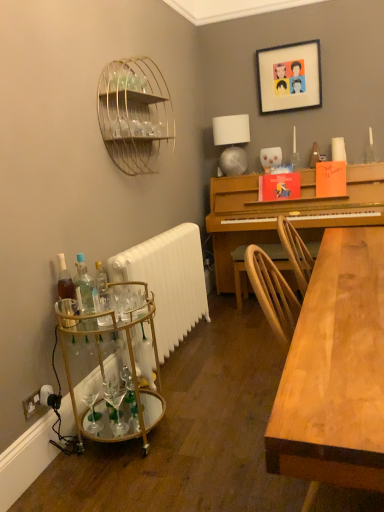
I want to click on clear glass bottle at left, which is counted as the 1th bottle, starting from the right, so [102, 289].

Image resolution: width=384 pixels, height=512 pixels. Describe the element at coordinates (102, 289) in the screenshot. I see `clear glass bottle at left, which ranks as the 3th bottle in left-to-right order` at that location.

Measure the distance between point (76, 263) and camera.

The depth of point (76, 263) is 6.58 feet.

This screenshot has height=512, width=384. What are the coordinates of `satin silver lampshade at upper right` in the screenshot? It's located at (232, 142).

Identify the location of translucent glass bottle at lower left, the 3th bottle when ordered from right to left. The height and width of the screenshot is (512, 384). (66, 290).

Looking at this image, measure the distance between point [303,106] and camera.

The distance of point [303,106] from camera is 11.98 feet.

At what (x,y) coordinates should I click in order to perform the action: click on gold wire shelf at upper left. Please return your answer as a coordinate pair (x, y). Looking at the image, I should click on (134, 113).

In order to click on table on the right side of clear glass bottle at left, which ranks as the 3th bottle in left-to-right order in this screenshot , I will do `click(112, 371)`.

Between clear glass bottle at left, which is counted as the 1th bottle, starting from the right, and gold glass bar cart at left, which one appears on the right side from the viewer's perspective?

Positioned to the right is gold glass bar cart at left.

Considering their positions, is clear glass bottle at left, which ranks as the 3th bottle in left-to-right order, located in front of or behind gold glass bar cart at left?

In the image, clear glass bottle at left, which ranks as the 3th bottle in left-to-right order, appears behind gold glass bar cart at left.

Does white matte radiator at lower left have a lesser height compared to translucent glass bottles at lower left, placed as the second bottle when sorted from left to right?

Incorrect, the height of white matte radiator at lower left does not fall short of that of translucent glass bottles at lower left, placed as the second bottle when sorted from left to right.

Is translucent glass bottles at lower left, arranged as the second bottle when viewed from the right, completely or partially inside white matte radiator at lower left?

No, translucent glass bottles at lower left, arranged as the second bottle when viewed from the right, is not inside white matte radiator at lower left.

From a real-world perspective, between white matte radiator at lower left and translucent glass bottles at lower left, arranged as the second bottle when viewed from the right, who is vertically lower?

In real-world perspective, white matte radiator at lower left is lower.

Can you confirm if white matte radiator at lower left is positioned to the left of translucent glass bottles at lower left, placed as the second bottle when sorted from left to right?

No.

Which object is positioned more to the right, gold glass bar cart at left or gold wire shelf at upper left?

→ gold wire shelf at upper left is more to the right.

Does gold glass bar cart at left lie in front of gold wire shelf at upper left?

Yes, it is.

Are gold glass bar cart at left and gold wire shelf at upper left located far from each other?

Yes, gold glass bar cart at left and gold wire shelf at upper left are located far from each other.

From a real-world perspective, who is located higher, wooden picture frame at upper center or gold wire shelf at upper left?

From a 3D spatial view, wooden picture frame at upper center is above.

In terms of height, does wooden picture frame at upper center look taller or shorter compared to gold wire shelf at upper left?

wooden picture frame at upper center is shorter than gold wire shelf at upper left.

From the picture: From the image's perspective, does wooden picture frame at upper center appear higher than gold wire shelf at upper left?

Yes.

Locate an element on the screen. The width and height of the screenshot is (384, 512). picture frame lying on the right of gold wire shelf at upper left is located at coordinates (289, 77).

Can you see clear glass bottle at left, which ranks as the 3th bottle in left-to-right order, touching satin silver lampshade at upper right?

No, clear glass bottle at left, which ranks as the 3th bottle in left-to-right order, is not in contact with satin silver lampshade at upper right.

Considering the relative sizes of clear glass bottle at left, which ranks as the 3th bottle in left-to-right order, and satin silver lampshade at upper right in the image provided, is clear glass bottle at left, which ranks as the 3th bottle in left-to-right order, thinner than satin silver lampshade at upper right?

Indeed, clear glass bottle at left, which ranks as the 3th bottle in left-to-right order, has a lesser width compared to satin silver lampshade at upper right.

From a real-world perspective, relative to satin silver lampshade at upper right, is clear glass bottle at left, which is counted as the 1th bottle, starting from the right, vertically above or below?

From a real-world perspective, clear glass bottle at left, which is counted as the 1th bottle, starting from the right, is physically below satin silver lampshade at upper right.

Is satin silver lampshade at upper right at the back of clear glass bottle at left, which is counted as the 1th bottle, starting from the right?

No, clear glass bottle at left, which is counted as the 1th bottle, starting from the right,'s orientation is not away from satin silver lampshade at upper right.

From the image's perspective, is white matte radiator at lower left beneath gold glass bar cart at left?

Incorrect, from the image's perspective, white matte radiator at lower left is higher than gold glass bar cart at left.

In the scene shown: Who is more distant, white matte radiator at lower left or gold glass bar cart at left?

white matte radiator at lower left.

Would you consider white matte radiator at lower left to be distant from gold glass bar cart at left?

That's not correct — white matte radiator at lower left is a little close to gold glass bar cart at left.

In the image, there is a gold glass bar cart at left. Identify the location of radiator above it (from the image's perspective). Image resolution: width=384 pixels, height=512 pixels. (168, 281).

At what (x,y) coordinates should I click in order to perform the action: click on bottle that is the 1st one when counting leftward from the satin silver lampshade at upper right. Please return your answer as a coordinate pair (x, y). The width and height of the screenshot is (384, 512). Looking at the image, I should click on (102, 289).

How many degrees apart are the facing directions of satin silver lampshade at upper right and clear glass bottle at left, which is counted as the 1th bottle, starting from the right?

The facing directions of satin silver lampshade at upper right and clear glass bottle at left, which is counted as the 1th bottle, starting from the right, are 76.3 degrees apart.

Which of these two, satin silver lampshade at upper right or clear glass bottle at left, which ranks as the 3th bottle in left-to-right order, stands shorter?

With less height is clear glass bottle at left, which ranks as the 3th bottle in left-to-right order.

Is point (232, 139) in front of point (104, 286)?

No, it is not.

Where is `bottle that is the 2nd object located above the gold glass bar cart at left (from the image's perspective)`? The height and width of the screenshot is (512, 384). bottle that is the 2nd object located above the gold glass bar cart at left (from the image's perspective) is located at coordinates (102, 289).

You are a GUI agent. You are given a task and a screenshot of the screen. Output one action in this format:
    pyautogui.click(x=<x>, y=<y>)
    Task: Click on the bottle that is the 3rd object above the white matte radiator at lower left (from a real-world perspective)
    Image resolution: width=384 pixels, height=512 pixels.
    Given the screenshot: What is the action you would take?
    pyautogui.click(x=84, y=284)

Estimate the real-world distances between objects in this image. Which object is further from light wood table at right, wooden picture frame at upper center or gold wire shelf at upper left?

wooden picture frame at upper center is further to light wood table at right.

When comparing their distances from translucent glass bottles at lower left, placed as the second bottle when sorted from left to right, does satin silver lampshade at upper right or white matte radiator at lower left seem closer?

Based on the image, white matte radiator at lower left appears to be nearer to translucent glass bottles at lower left, placed as the second bottle when sorted from left to right.

Which object lies further to the anchor point white matte radiator at lower left, satin silver lampshade at upper right or gold wire shelf at upper left?

satin silver lampshade at upper right is positioned further to the anchor white matte radiator at lower left.

In the scene shown: Which object lies further to the anchor point gold glass bar cart at left, clear glass bottle at left, which ranks as the 3th bottle in left-to-right order, or gold wire shelf at upper left?

Based on the image, gold wire shelf at upper left appears to be further to gold glass bar cart at left.

Considering their positions, is wooden picture frame at upper center positioned closer to gold wire shelf at upper left than translucent glass bottles at lower left, arranged as the second bottle when viewed from the right?

Among the two, translucent glass bottles at lower left, arranged as the second bottle when viewed from the right, is located nearer to gold wire shelf at upper left.

Based on their spatial positions, is satin silver lampshade at upper right or light wood table at right closer to translucent glass bottles at lower left, arranged as the second bottle when viewed from the right?

Among the two, light wood table at right is located nearer to translucent glass bottles at lower left, arranged as the second bottle when viewed from the right.

Considering their positions, is light wood table at right positioned closer to clear glass bottle at left, which is counted as the 1th bottle, starting from the right, than wooden picture frame at upper center?

Based on the image, light wood table at right appears to be nearer to clear glass bottle at left, which is counted as the 1th bottle, starting from the right.

Consider the image. Estimate the real-world distances between objects in this image. Which object is further from translucent glass bottles at lower left, arranged as the second bottle when viewed from the right, translucent glass bottle at lower left, the 3th bottle when ordered from right to left, or wooden picture frame at upper center?

wooden picture frame at upper center lies further to translucent glass bottles at lower left, arranged as the second bottle when viewed from the right, than the other object.

Locate an element on the screen. lamp between wooden picture frame at upper center and white matte radiator at lower left vertically is located at coordinates (232, 142).

Image resolution: width=384 pixels, height=512 pixels. I want to click on shelf positioned between translucent glass bottles at lower left, placed as the second bottle when sorted from left to right, and satin silver lampshade at upper right from near to far, so click(x=134, y=113).

Identify the location of radiator between translucent glass bottle at lower left, acting as the first bottle starting from the left, and satin silver lampshade at upper right from front to back. (168, 281).

I want to click on picture frame positioned between light wood table at right and satin silver lampshade at upper right from near to far, so click(x=289, y=77).